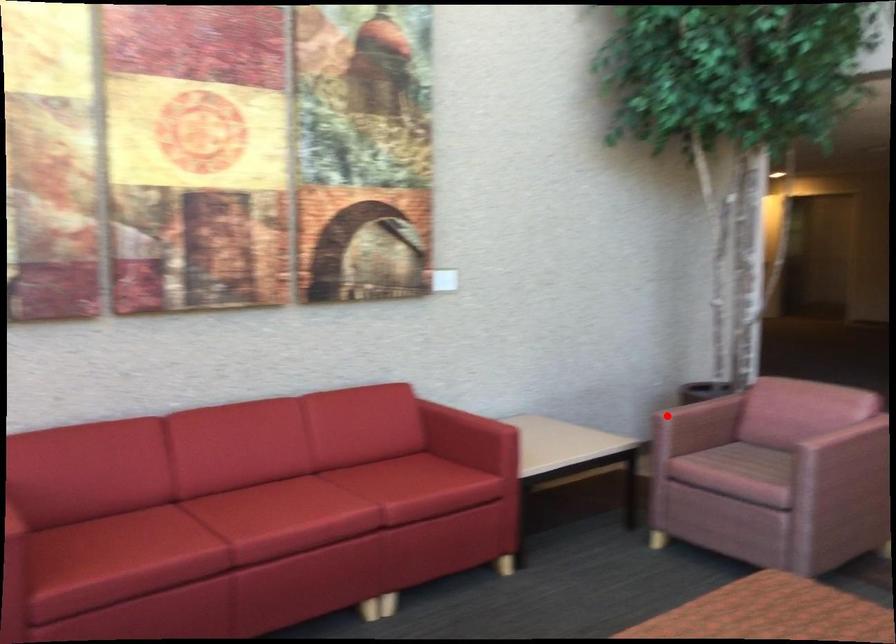
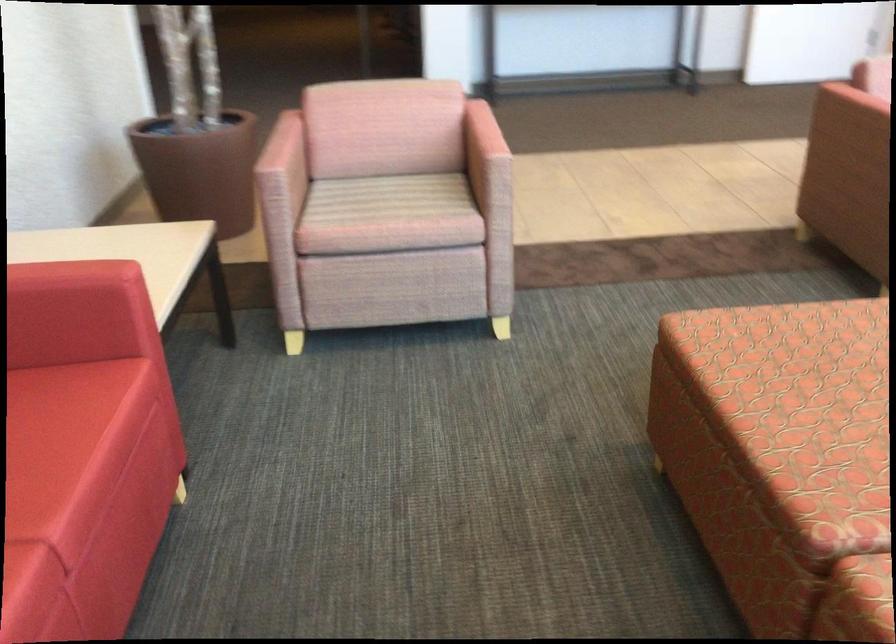
Question: A red point is marked in image1. In image2, is the corresponding 3D point closer to the camera or farther? Reply with the corresponding letter.

Choices:
 (A) The corresponding 3D point is closer.
 (B) The corresponding 3D point is farther.

Answer: (A)